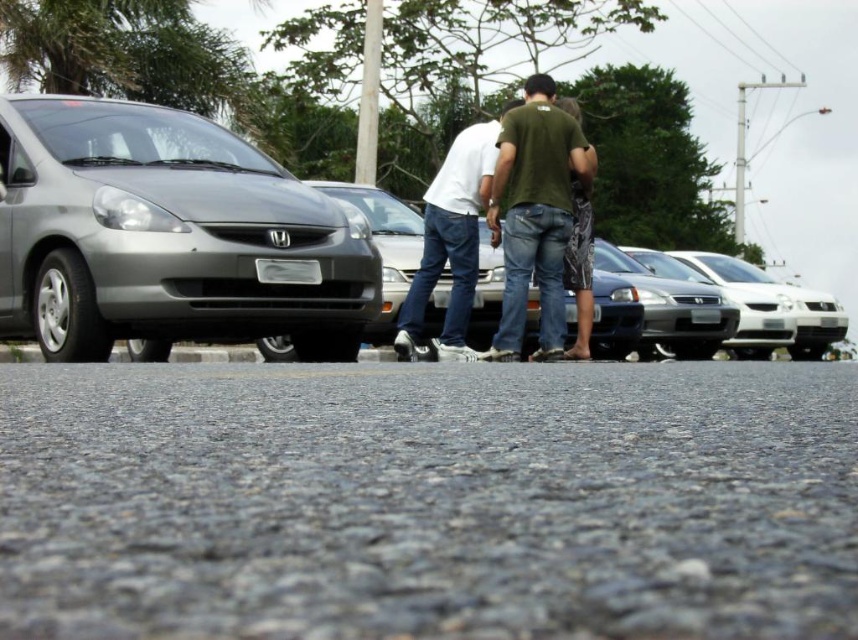
You are a delivery person trying to park your van in the street. You see the gray asphalt at center and the shiny silver sedan at center. Which area has more space to park?

The shiny silver sedan at center has more space available for parking since the gray asphalt at center is smaller in size, indicating less space.

You are standing at the point with coordinates point (7, 257) and want to walk to the point with coordinates point (835, 600). Which direction should you move in to reach your destination?

You should move forward because point (835, 600) is in front of point (7, 257).

You are a pedestrian standing on the gray asphalt at center. You want to cross the street to reach the other side. Is the satin silver car at left blocking your path?

The gray asphalt at center is in front of the satin silver car at left, meaning the car is behind you and not blocking your path. You can safely cross the street.